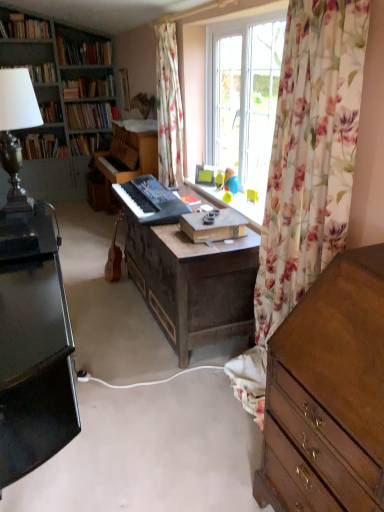
Question: In which direction should I rotate to look at floral fabric curtain at center, the 1th curtain in the back-to-front sequence?

Choices:
 (A) left
 (B) right

Answer: (A)

Question: From a real-world perspective, is wooden picture frame at upper center located higher than black matte keyboard at center?

Choices:
 (A) yes
 (B) no

Answer: (A)

Question: From a real-world perspective, is wooden picture frame at upper center beneath black matte keyboard at center?

Choices:
 (A) yes
 (B) no

Answer: (B)

Question: Does wooden picture frame at upper center lie in front of black matte keyboard at center?

Choices:
 (A) no
 (B) yes

Answer: (A)

Question: Does wooden picture frame at upper center have a larger size compared to black matte keyboard at center?

Choices:
 (A) no
 (B) yes

Answer: (A)

Question: Is wooden picture frame at upper center aimed at black matte keyboard at center?

Choices:
 (A) yes
 (B) no

Answer: (B)

Question: From the image's perspective, is wooden picture frame at upper center above black matte keyboard at center?

Choices:
 (A) yes
 (B) no

Answer: (A)

Question: Is hardcover book at center, which is the fourth book in bottom-to-top order, facing away from hardcover books at upper left, acting as the sixth book starting from the bottom?

Choices:
 (A) yes
 (B) no

Answer: (B)

Question: Is hardcover book at center, acting as the fourth book starting from the top, bigger than hardcover books at upper left, acting as the sixth book starting from the bottom?

Choices:
 (A) no
 (B) yes

Answer: (A)

Question: From a real-world perspective, is hardcover book at center, acting as the fourth book starting from the top, on hardcover books at upper left, which ranks as the 2th book in top-to-bottom order?

Choices:
 (A) yes
 (B) no

Answer: (B)

Question: Considering the relative sizes of hardcover book at center, acting as the fourth book starting from the top, and hardcover books at upper left, which ranks as the 2th book in top-to-bottom order, in the image provided, is hardcover book at center, acting as the fourth book starting from the top, shorter than hardcover books at upper left, which ranks as the 2th book in top-to-bottom order,?

Choices:
 (A) no
 (B) yes

Answer: (A)

Question: From the image's perspective, is hardcover book at center, which is the fourth book in bottom-to-top order, below hardcover books at upper left, acting as the sixth book starting from the bottom?

Choices:
 (A) no
 (B) yes

Answer: (B)

Question: Is there a large distance between hardcover book at center, which is the fourth book in bottom-to-top order, and hardcover books at upper left, which ranks as the 2th book in top-to-bottom order?

Choices:
 (A) no
 (B) yes

Answer: (A)

Question: Is metallic silver lampshade at upper left turned away from wooden bookcase at left?

Choices:
 (A) no
 (B) yes

Answer: (A)